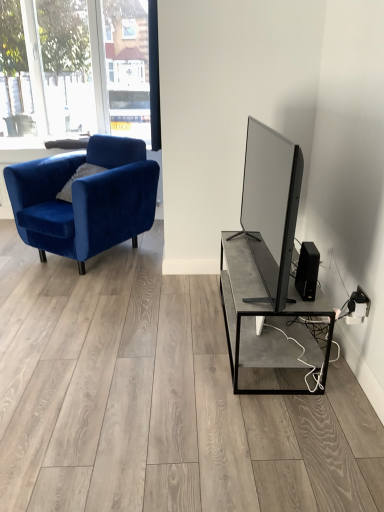
Question: Is black matte speaker at lower right aimed at velvet blue armchair at left?

Choices:
 (A) yes
 (B) no

Answer: (B)

Question: Does black matte speaker at lower right lie behind velvet blue armchair at left?

Choices:
 (A) yes
 (B) no

Answer: (B)

Question: Is black matte speaker at lower right bigger than velvet blue armchair at left?

Choices:
 (A) yes
 (B) no

Answer: (B)

Question: From a real-world perspective, is black matte speaker at lower right physically below velvet blue armchair at left?

Choices:
 (A) no
 (B) yes

Answer: (A)

Question: Is black matte speaker at lower right thinner than velvet blue armchair at left?

Choices:
 (A) no
 (B) yes

Answer: (B)

Question: Is black matte speaker at lower right looking in the opposite direction of velvet blue armchair at left?

Choices:
 (A) no
 (B) yes

Answer: (A)

Question: Could you tell me if velvet blue armchair at left is facing black matte speaker at lower right?

Choices:
 (A) no
 (B) yes

Answer: (A)

Question: Is the surface of velvet blue armchair at left in direct contact with black matte speaker at lower right?

Choices:
 (A) no
 (B) yes

Answer: (A)

Question: Is velvet blue armchair at left at the left side of black matte speaker at lower right?

Choices:
 (A) yes
 (B) no

Answer: (A)

Question: Can you confirm if velvet blue armchair at left is wider than black matte speaker at lower right?

Choices:
 (A) no
 (B) yes

Answer: (B)

Question: Considering the relative positions of velvet blue armchair at left and black matte speaker at lower right in the image provided, is velvet blue armchair at left in front of black matte speaker at lower right?

Choices:
 (A) no
 (B) yes

Answer: (A)

Question: Considering the relative sizes of velvet blue armchair at left and black matte speaker at lower right in the image provided, is velvet blue armchair at left bigger than black matte speaker at lower right?

Choices:
 (A) no
 (B) yes

Answer: (B)

Question: Looking at their shapes, would you say black matte speaker at lower right is wider or thinner than velvet blue armchair at left?

Choices:
 (A) wide
 (B) thin

Answer: (B)